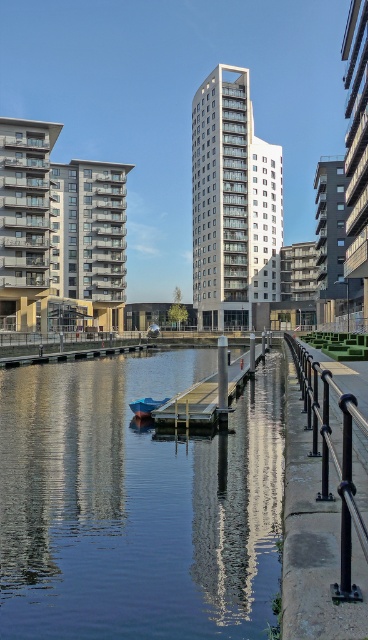
Question: Which object is the closest to the blue glossy boat at center?

Choices:
 (A) smooth glass water at center
 (B) black metal railing at right
 (C) wooden dock at center

Answer: (A)

Question: Which object appears farthest from the camera in this image?

Choices:
 (A) black metal railing at right
 (B) wooden dock at center
 (C) blue glossy boat at center
 (D) smooth glass water at center

Answer: (C)

Question: Where is smooth glass water at center located in relation to wooden dock at center in the image?

Choices:
 (A) left
 (B) right

Answer: (A)

Question: Does black metal railing at right have a larger size compared to blue glossy boat at center?

Choices:
 (A) yes
 (B) no

Answer: (A)

Question: Is smooth glass water at center further to the viewer compared to blue glossy boat at center?

Choices:
 (A) yes
 (B) no

Answer: (B)

Question: Which point is closer to the camera?

Choices:
 (A) black metal railing at right
 (B) blue glossy boat at center
 (C) smooth glass water at center

Answer: (A)